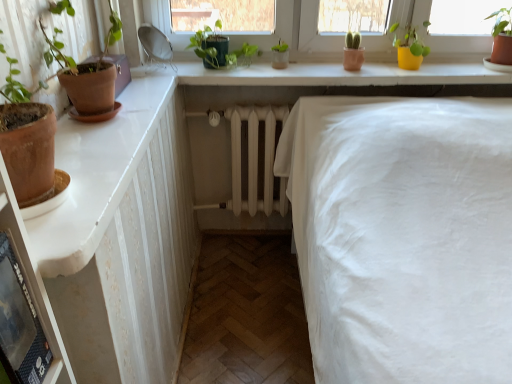
Question: Would you say black plastic shelf at lower left is to the left or to the right of yellow matte pot at upper right, placed as the first houseplant when sorted from right to left, in the picture?

Choices:
 (A) right
 (B) left

Answer: (B)

Question: Considering the positions of point (x=29, y=249) and point (x=409, y=24), is point (x=29, y=249) closer or farther from the camera than point (x=409, y=24)?

Choices:
 (A) farther
 (B) closer

Answer: (B)

Question: Estimate the real-world distances between objects in this image. Which object is closer to the white glossy dresser at left?

Choices:
 (A) green matte flowerpot at center
 (B) green matte plant at upper center, acting as the 1th houseplant starting from the left
 (C) terracotta clay pot at left
 (D) black plastic shelf at lower left
 (E) yellow matte pot at upper right, positioned as the 2th houseplant in left-to-right order

Answer: (D)

Question: Which of these objects is positioned farthest from the white glossy dresser at left?

Choices:
 (A) black plastic shelf at lower left
 (B) green matte flowerpot at center
 (C) yellow matte pot at upper right, positioned as the 2th houseplant in left-to-right order
 (D) green matte plant at upper center, acting as the 1th houseplant starting from the left
 (E) terracotta clay pot at left

Answer: (C)